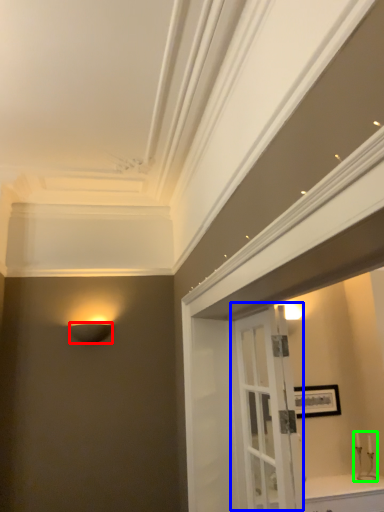
Question: Which object is the farthest from lamp (highlighted by a red box)? Choose among these: door (highlighted by a blue box) or candle holder (highlighted by a green box).

Choices:
 (A) door
 (B) candle holder

Answer: (B)